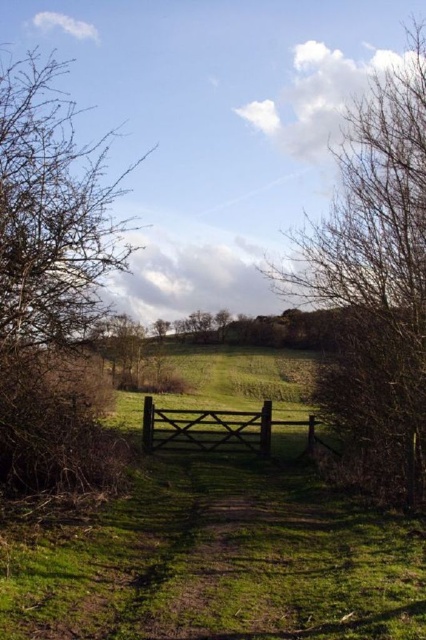
Question: Which object is the farthest from the brown wooden gate at center?

Choices:
 (A) bare branches at right
 (B) bare branches at left

Answer: (B)

Question: Which of the following is the farthest from the observer?

Choices:
 (A) brown wooden gate at center
 (B) bare branches at left

Answer: (A)

Question: Can you confirm if bare branches at left is smaller than brown wooden gate at center?

Choices:
 (A) yes
 (B) no

Answer: (B)

Question: Is bare branches at right bigger than brown wooden gate at center?

Choices:
 (A) yes
 (B) no

Answer: (A)

Question: Can you confirm if bare branches at left is positioned to the right of brown wooden gate at center?

Choices:
 (A) yes
 (B) no

Answer: (B)

Question: Which object is farther from the camera taking this photo?

Choices:
 (A) bare branches at left
 (B) bare branches at right
 (C) brown wooden gate at center

Answer: (C)